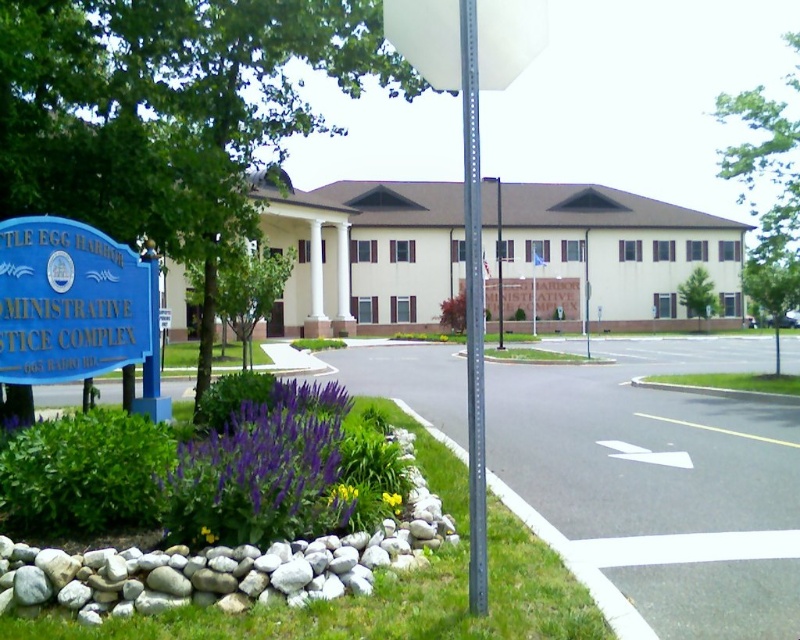
Question: Can you confirm if purple matte flower at lower center is wider than metallic gray pole at center?

Choices:
 (A) yes
 (B) no

Answer: (B)

Question: Which object appears farthest from the camera in this image?

Choices:
 (A) yellow matte flower at lower center
 (B) metallic gray pole at center

Answer: (A)

Question: Which point appears farthest from the camera in this image?

Choices:
 (A) (160, 328)
 (B) (468, 230)
 (C) (222, 483)
 (D) (398, 500)

Answer: (A)

Question: In this image, where is metallic gray pole at center located relative to white plastic sign at upper center?

Choices:
 (A) right
 (B) left

Answer: (A)

Question: Which object appears farthest from the camera in this image?

Choices:
 (A) metallic gray pole at center
 (B) blue plastic sign at left
 (C) yellow matte flower at lower center

Answer: (B)

Question: Can you confirm if purple matte flower at lower center is thinner than white plastic sign at upper center?

Choices:
 (A) yes
 (B) no

Answer: (A)